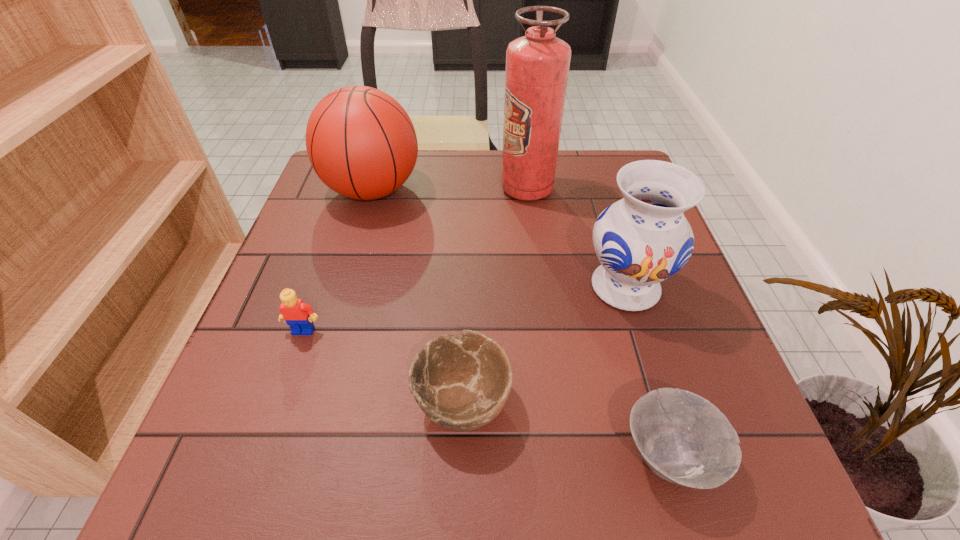
This screenshot has height=540, width=960. Find the location of `basketball at the left edge`. basketball at the left edge is located at coordinates (360, 141).

This screenshot has height=540, width=960. Identify the location of Lego present at the left edge. (299, 316).

You are a GUI agent. You are given a task and a screenshot of the screen. Output one action in this format:
    pyautogui.click(x=<x>, y=<y>)
    Task: Click on the vase located in the right edge section of the desktop
    This screenshot has height=540, width=960.
    Given the screenshot: What is the action you would take?
    pyautogui.click(x=643, y=239)

Where is `bowl that is at the right edge`? The image size is (960, 540). bowl that is at the right edge is located at coordinates (683, 438).

Identify the location of object that is at the far left corner. (360, 141).

In order to click on object situated at the near right corner in this screenshot , I will do `click(683, 438)`.

The width and height of the screenshot is (960, 540). Identify the location of vacant region at the far edge of the desktop. (451, 167).

Where is `free point at the near edge`? The height and width of the screenshot is (540, 960). free point at the near edge is located at coordinates (432, 480).

Where is `blank area at the left edge`? blank area at the left edge is located at coordinates (361, 224).

You are a GUI agent. You are given a task and a screenshot of the screen. Output one action in this format:
    pyautogui.click(x=<x>, y=<y>)
    Task: Click on the vacant region at the right edge
    This screenshot has width=960, height=540.
    Given the screenshot: What is the action you would take?
    pyautogui.click(x=695, y=319)